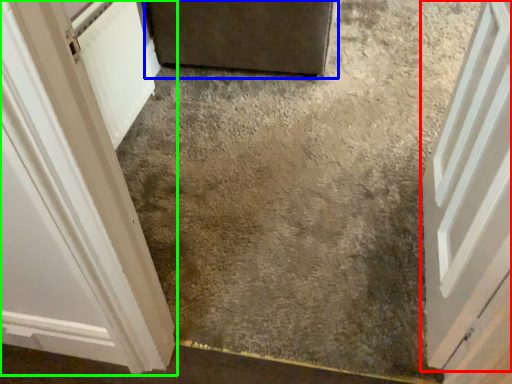
Question: Which is farther away from door (highlighted by a red box)? door (highlighted by a blue box) or door (highlighted by a green box)?

Choices:
 (A) door
 (B) door

Answer: (A)